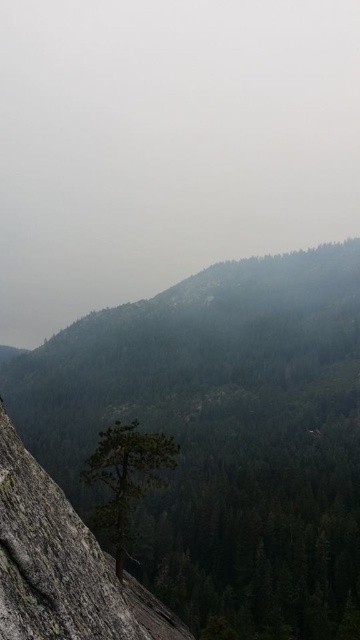
Question: Is green textured tree at center further to the viewer compared to gray rough rock at center?

Choices:
 (A) no
 (B) yes

Answer: (B)

Question: Observing the image, what is the correct spatial positioning of green textured tree at center in reference to gray rough rock at center?

Choices:
 (A) left
 (B) right

Answer: (A)

Question: Which point is farther to the camera?

Choices:
 (A) (39, 499)
 (B) (276, 317)

Answer: (B)

Question: Which point is closer to the camera?

Choices:
 (A) gray rough rock at center
 (B) green textured tree at center

Answer: (A)

Question: Is green textured tree at center thinner than gray rough rock at center?

Choices:
 (A) no
 (B) yes

Answer: (A)

Question: Among these objects, which one is nearest to the camera?

Choices:
 (A) gray rough rock at center
 (B) green textured tree at center

Answer: (A)